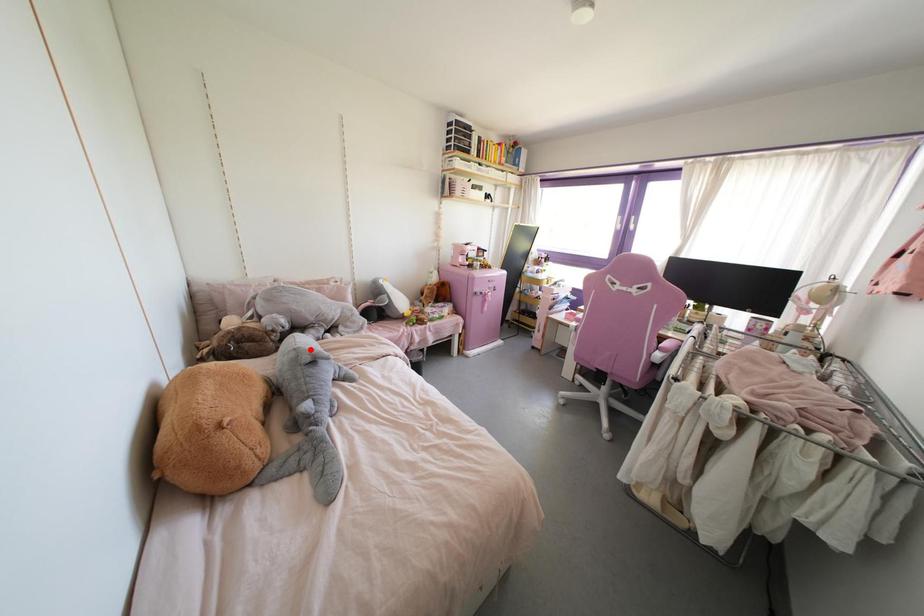
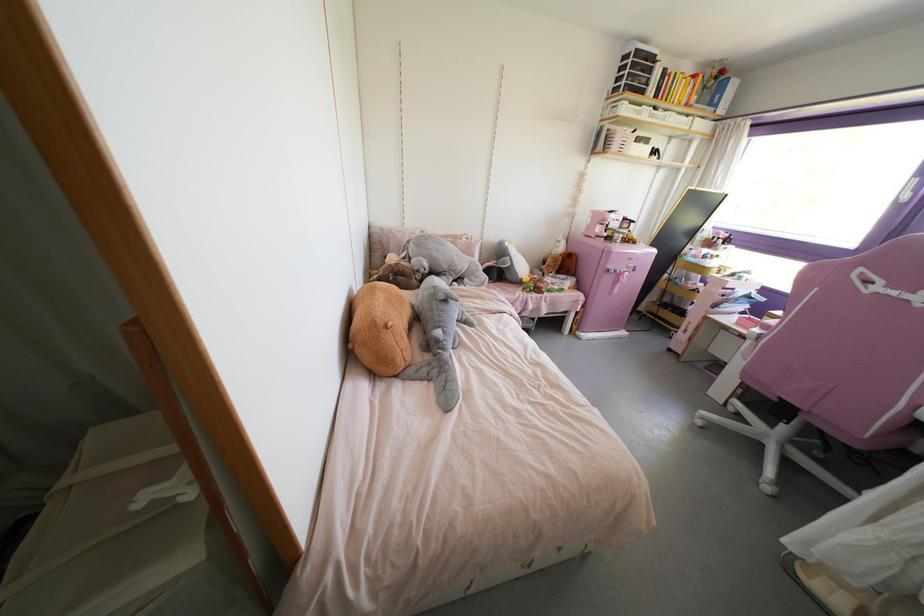
Question: I am providing you with two images of the same scene from different viewpoints. Image1 has a red point marked. In image2, the corresponding 3D location appears at what relative position? Reply with the corresponding letter.

Choices:
 (A) Closer
 (B) Farther

Answer: (B)